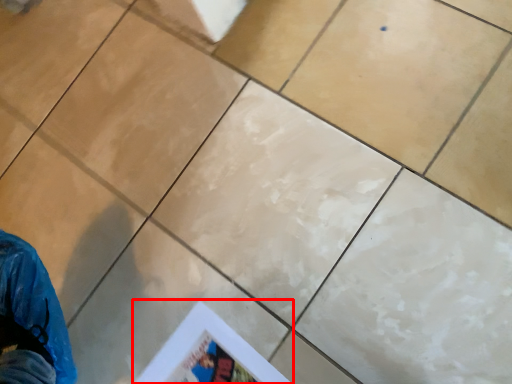
Question: Observing the image, what is the correct spatial positioning of poster page (annotated by the red box) in reference to ceramic tile?

Choices:
 (A) left
 (B) right

Answer: (A)